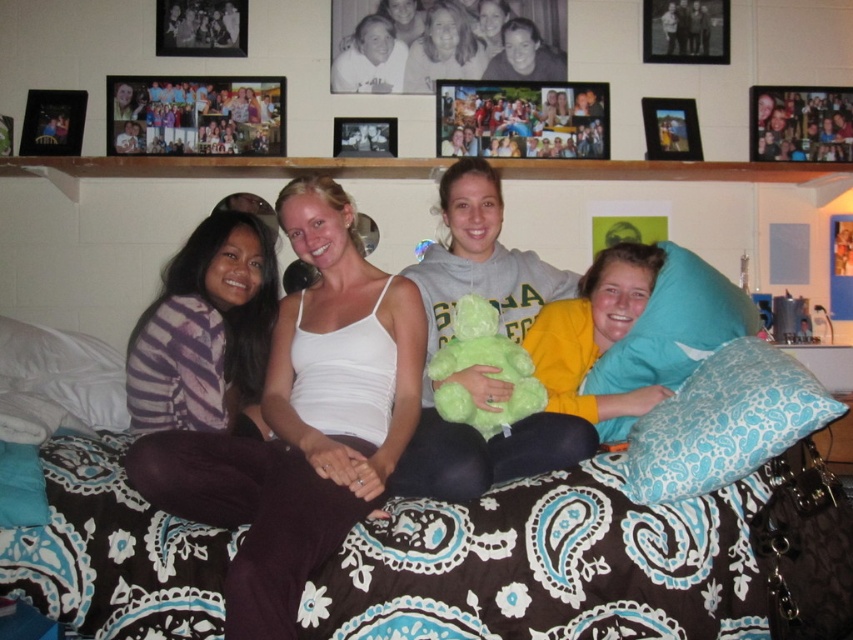
Who is taller, white glossy photo frame at upper center or metallic photo frame at upper right?

Standing taller between the two is white glossy photo frame at upper center.

From the picture: Can you confirm if white glossy photo frame at upper center is positioned above metallic photo frame at upper right?

No.

Which is in front, point (341, 36) or point (668, 45)?

Positioned in front is point (341, 36).

You are a GUI agent. You are given a task and a screenshot of the screen. Output one action in this format:
    pyautogui.click(x=<x>, y=<y>)
    Task: Click on the white glossy photo frame at upper center
    The width and height of the screenshot is (853, 640).
    Given the screenshot: What is the action you would take?
    pyautogui.click(x=442, y=42)

Is white matte tank top at center taller than white soft pillow at left?

Yes.

Consider the image. Who is positioned more to the right, white matte tank top at center or white soft pillow at left?

Positioned to the right is white matte tank top at center.

Between point (323, 497) and point (68, 381), which one is positioned in front?

Point (323, 497)

At what (x,y) coordinates should I click in order to perform the action: click on white matte tank top at center. Please return your answer as a coordinate pair (x, y). Looking at the image, I should click on (323, 410).

Between point (531, 404) and point (717, 26), which one is positioned behind?

The point (717, 26) is behind.

Between green plush at center and metallic photo frame at upper right, which one is positioned higher?

metallic photo frame at upper right is above.

You are a GUI agent. You are given a task and a screenshot of the screen. Output one action in this format:
    pyautogui.click(x=<x>, y=<y>)
    Task: Click on the green plush at center
    
    Given the screenshot: What is the action you would take?
    pyautogui.click(x=483, y=364)